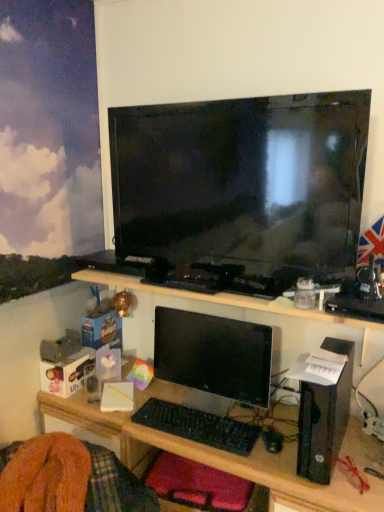
Find the location of a particular element. The height and width of the screenshot is (512, 384). free spot behind black plastic mouse at lower center is located at coordinates coord(272,421).